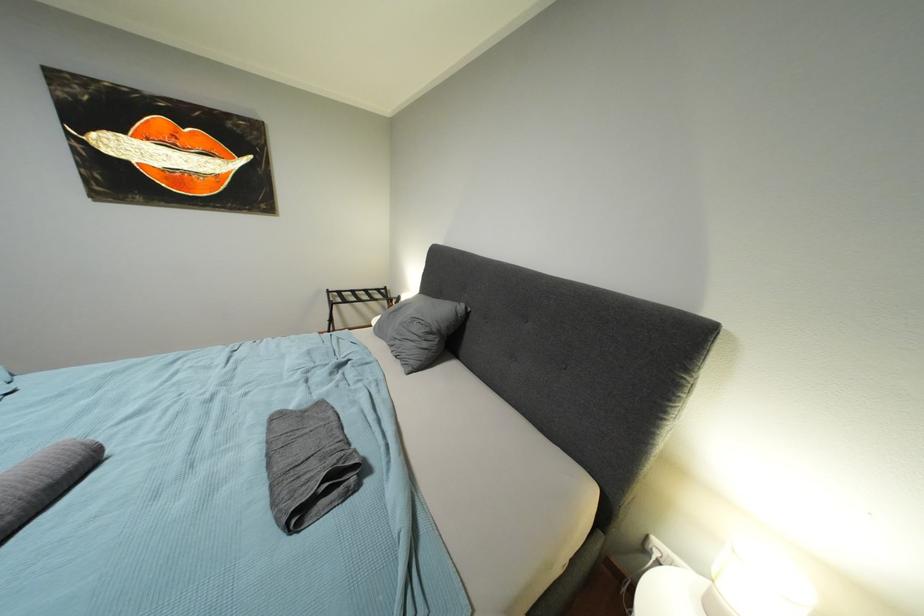
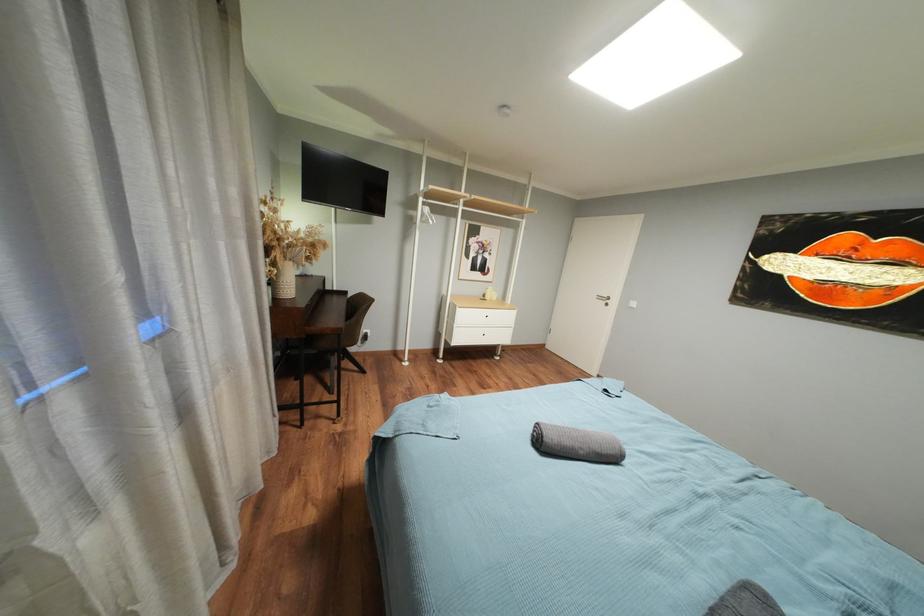
Question: How did the camera likely rotate?

Choices:
 (A) Left
 (B) Right
 (C) Up
 (D) Down

Answer: (A)